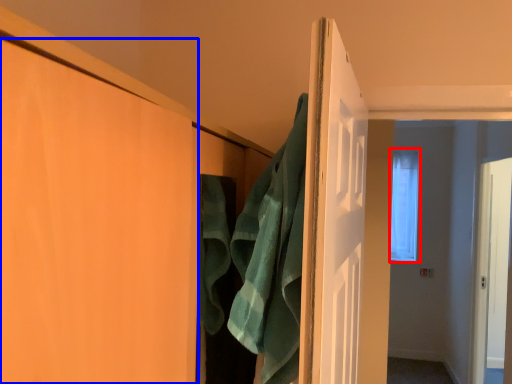
Question: Which point is further to the camera, window (highlighted by a red box) or door (highlighted by a blue box)?

Choices:
 (A) window
 (B) door

Answer: (A)